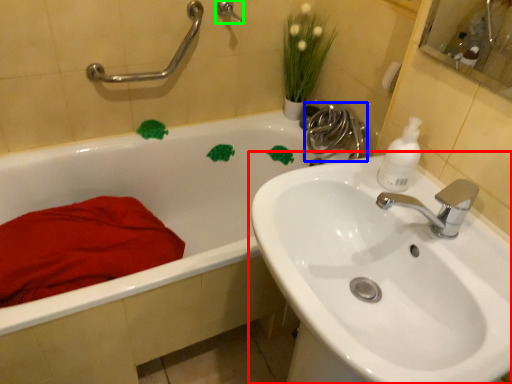
Question: Based on their relative distances, which object is farther from sink (highlighted by a red box)? Choose from plumbing fixture (highlighted by a blue box) and shower (highlighted by a green box).

Choices:
 (A) plumbing fixture
 (B) shower

Answer: (B)